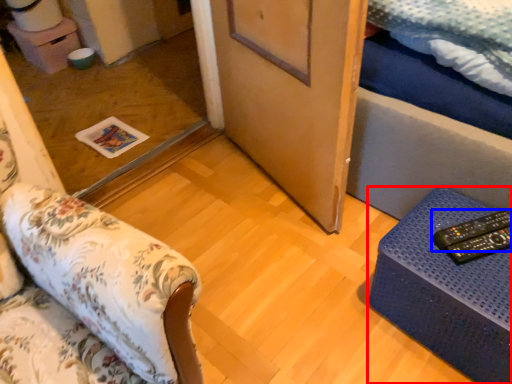
Question: Which point is further to the camera, furniture (highlighted by a red box) or remote (highlighted by a blue box)?

Choices:
 (A) furniture
 (B) remote

Answer: (B)